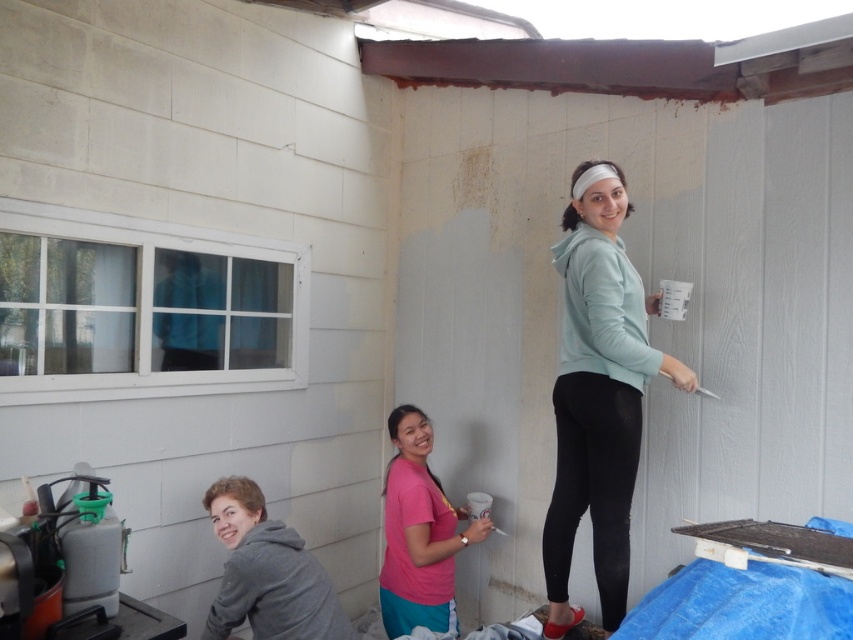
Find the location of `matte teal hoodie at center`. matte teal hoodie at center is located at coordinates (598, 394).

Between matte teal hoodie at center and pink matte shirt at center, which one has less height?

pink matte shirt at center is shorter.

In the scene shown: Who is more distant from viewer, (573, 266) or (437, 496)?

The point (437, 496) is behind.

Where is `matte teal hoodie at center`? matte teal hoodie at center is located at coordinates (598, 394).